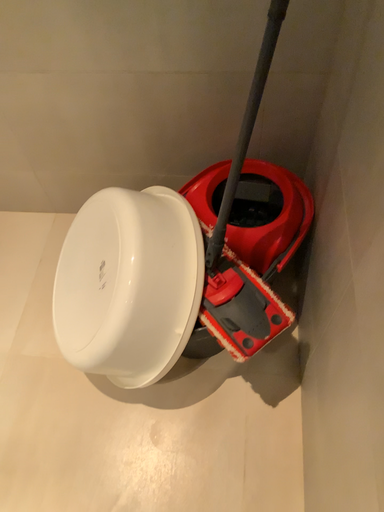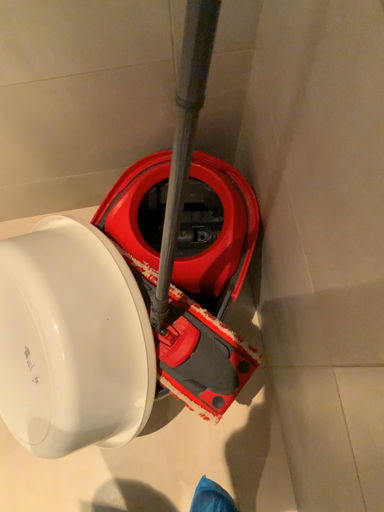
Question: How did the camera likely rotate when shooting the video?

Choices:
 (A) rotated downward
 (B) rotated upward

Answer: (A)